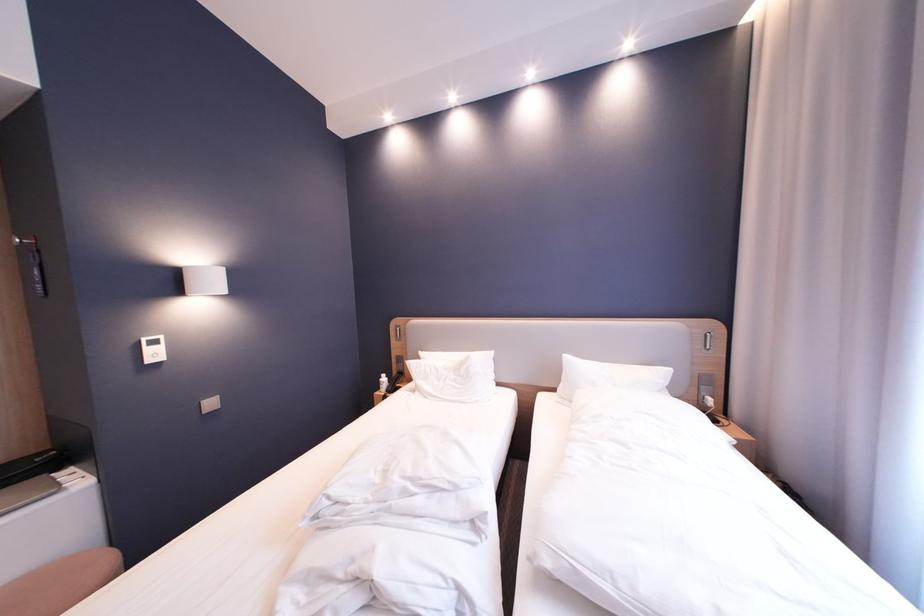
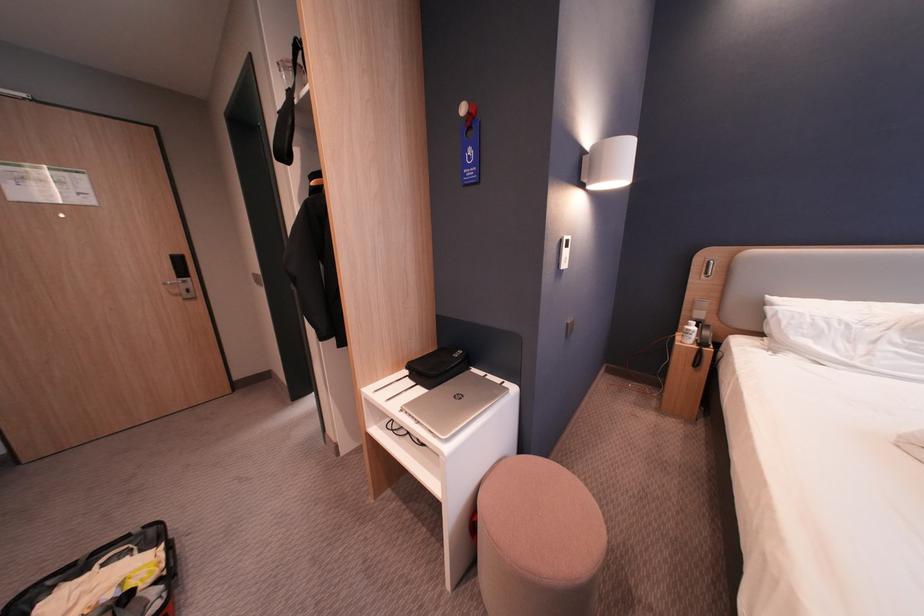
Find the pixel in the second image that matches the point at 148,341 in the first image.

(569, 240)